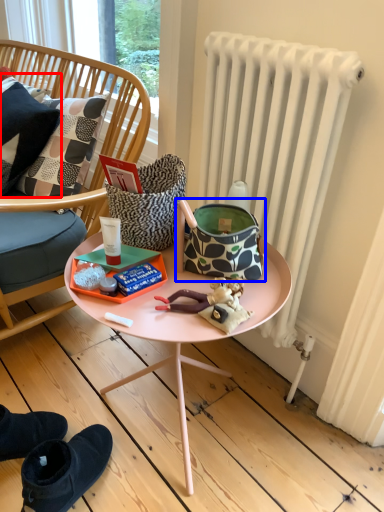
Question: Which point is closer to the camera, pillow (highlighted by a red box) or handbag (highlighted by a blue box)?

Choices:
 (A) pillow
 (B) handbag

Answer: (B)